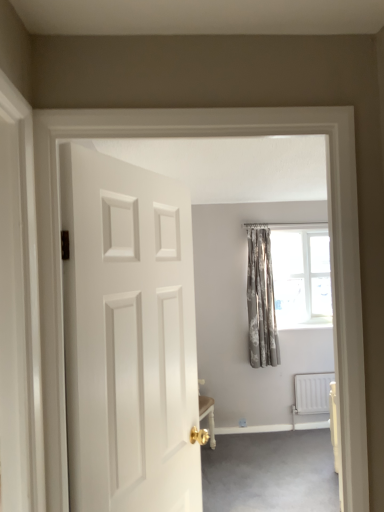
Question: Should I look upward or downward to see patterned fabric curtain at upper right?

Choices:
 (A) up
 (B) down

Answer: (B)

Question: Is carpet at lower right in contact with white matte door at center?

Choices:
 (A) yes
 (B) no

Answer: (B)

Question: Can you confirm if carpet at lower right is positioned to the right of white matte door at center?

Choices:
 (A) yes
 (B) no

Answer: (A)

Question: From the image's perspective, does carpet at lower right appear lower than white matte door at center?

Choices:
 (A) yes
 (B) no

Answer: (A)

Question: Is carpet at lower right bigger than white matte door at center?

Choices:
 (A) yes
 (B) no

Answer: (B)

Question: Does carpet at lower right turn towards white matte door at center?

Choices:
 (A) yes
 (B) no

Answer: (B)

Question: Considering the relative sizes of carpet at lower right and white matte door at center in the image provided, is carpet at lower right smaller than white matte door at center?

Choices:
 (A) yes
 (B) no

Answer: (A)

Question: Is white metallic radiator at lower right bigger than carpet at lower right?

Choices:
 (A) no
 (B) yes

Answer: (A)

Question: Is white metallic radiator at lower right looking in the opposite direction of carpet at lower right?

Choices:
 (A) yes
 (B) no

Answer: (B)

Question: Would you consider white metallic radiator at lower right to be distant from carpet at lower right?

Choices:
 (A) no
 (B) yes

Answer: (A)

Question: Can you confirm if white metallic radiator at lower right is shorter than carpet at lower right?

Choices:
 (A) yes
 (B) no

Answer: (B)

Question: Can you confirm if white metallic radiator at lower right is taller than carpet at lower right?

Choices:
 (A) yes
 (B) no

Answer: (A)

Question: Would you say carpet at lower right is part of white metallic radiator at lower right's contents?

Choices:
 (A) no
 (B) yes

Answer: (A)

Question: Does white metallic radiator at lower right have a lesser width compared to patterned fabric curtain at upper right?

Choices:
 (A) yes
 (B) no

Answer: (A)